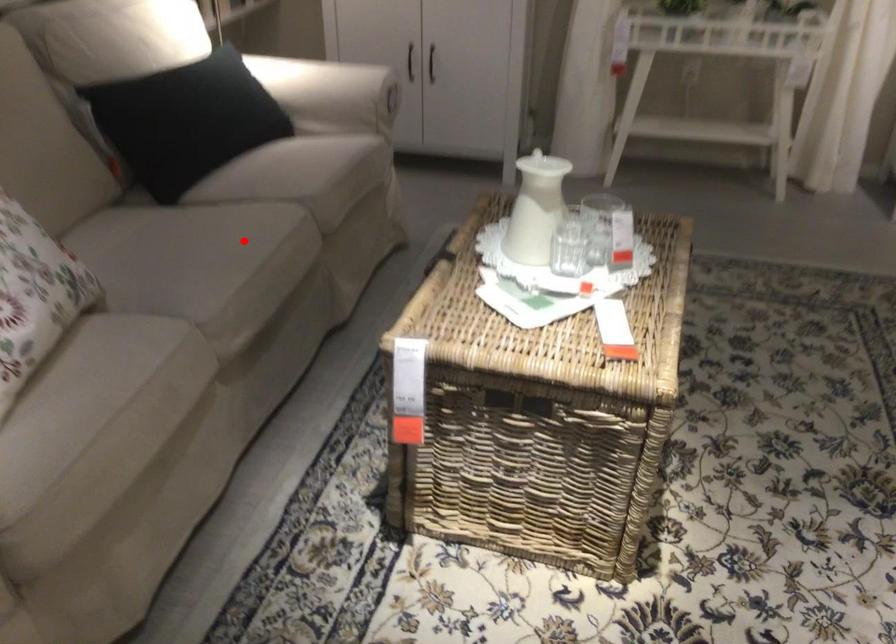
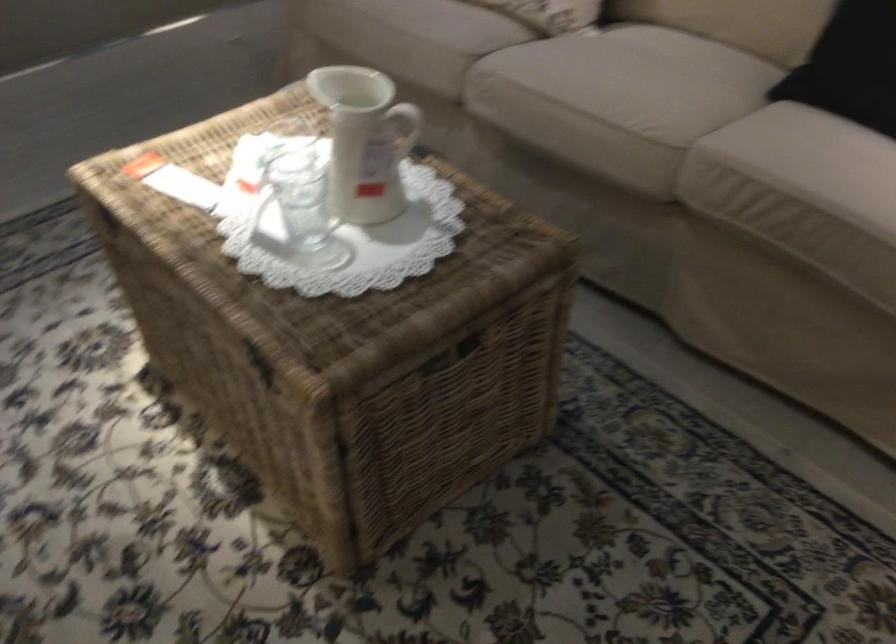
The point at the highlighted location is marked in the first image. Where is the corresponding point in the second image?

(617, 93)